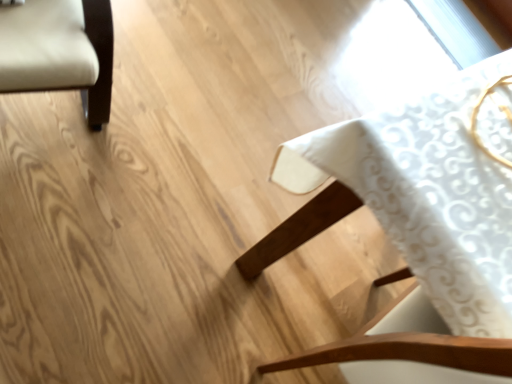
At what (x,y) coordinates should I click in order to perform the action: click on free space that is to the left of wooden chair at upper right. Please return your answer as a coordinate pair (x, y). Looking at the image, I should click on (140, 193).